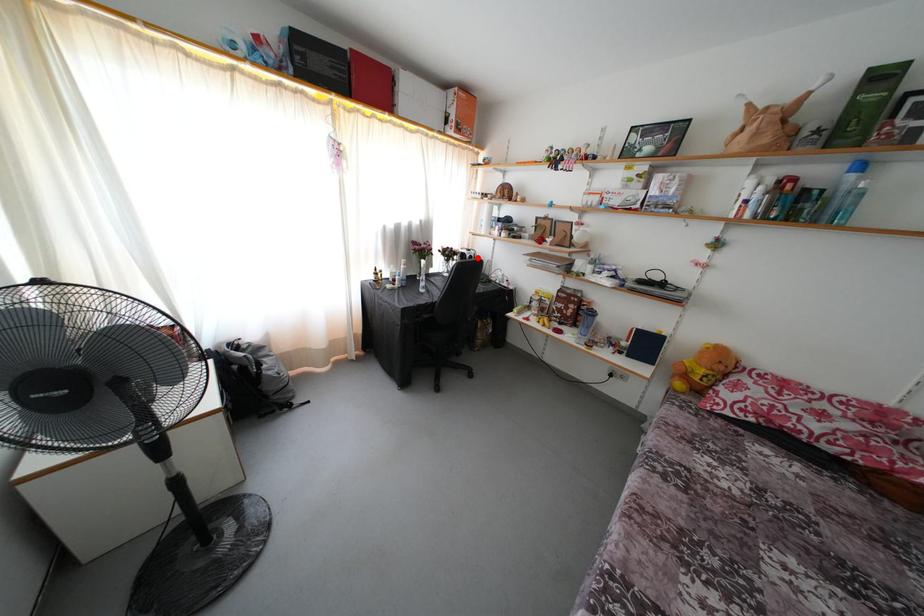
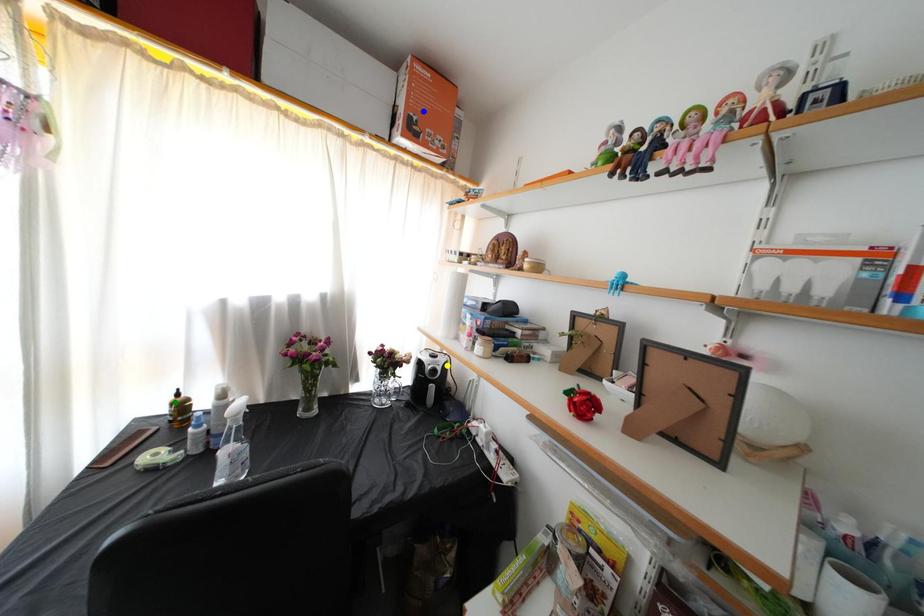
Question: I am providing you with two images of the same scene from different viewpoints. A red point is marked on the first image. You are given multiple points on the second image. Which point in image 2 is actually the same real-world point as the red point in image 1?

Choices:
 (A) green point
 (B) blue point
 (C) yellow point

Answer: (C)